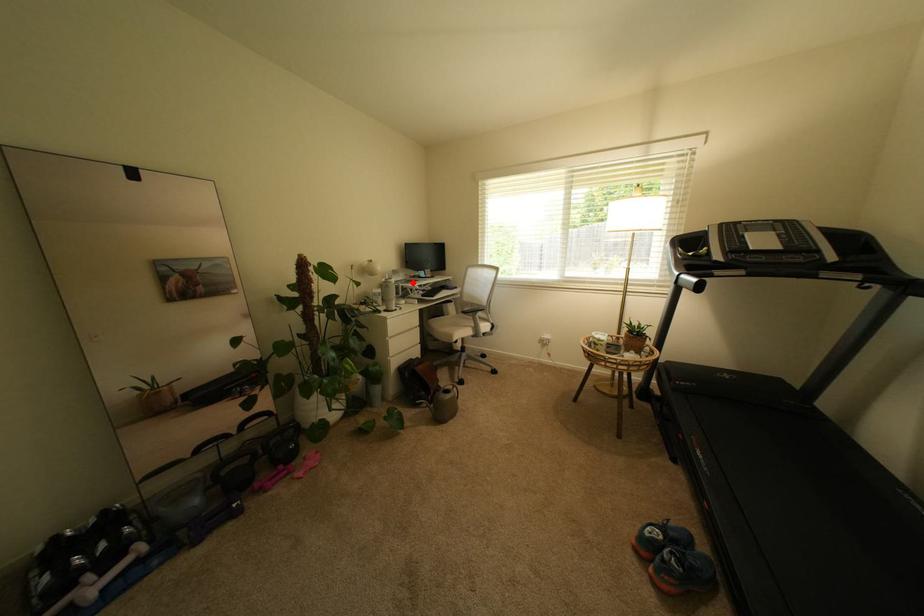
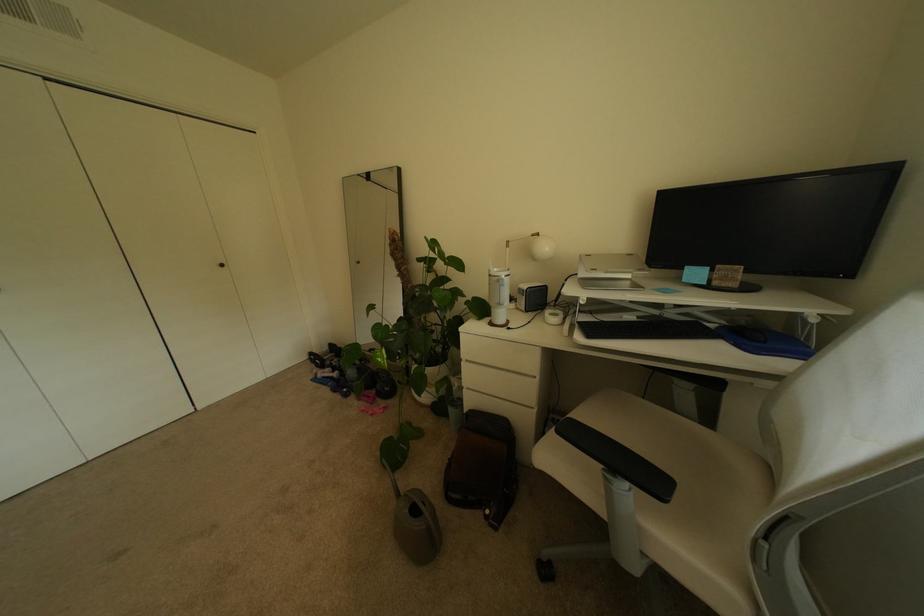
Find the pixel in the second image that matches the highlighted location in the first image.

(637, 284)